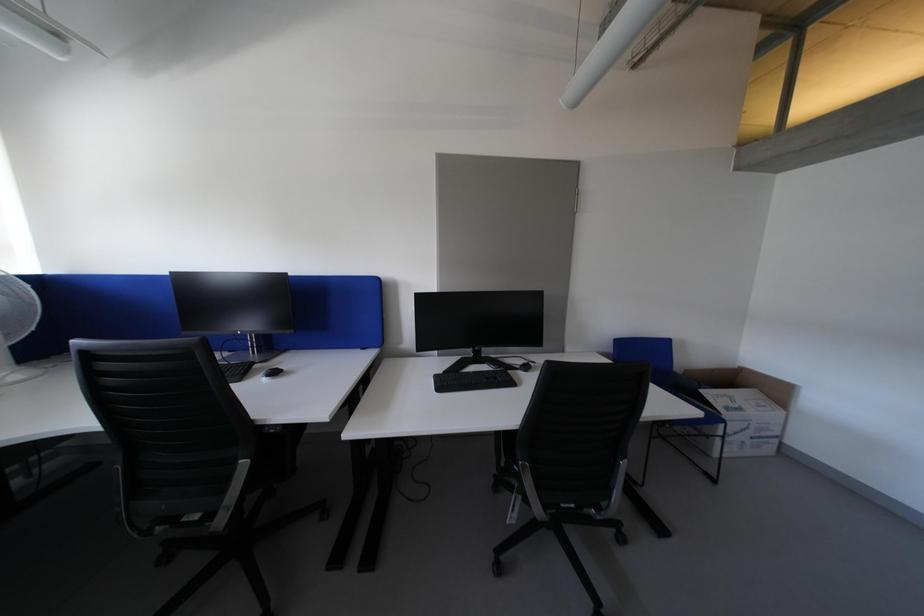
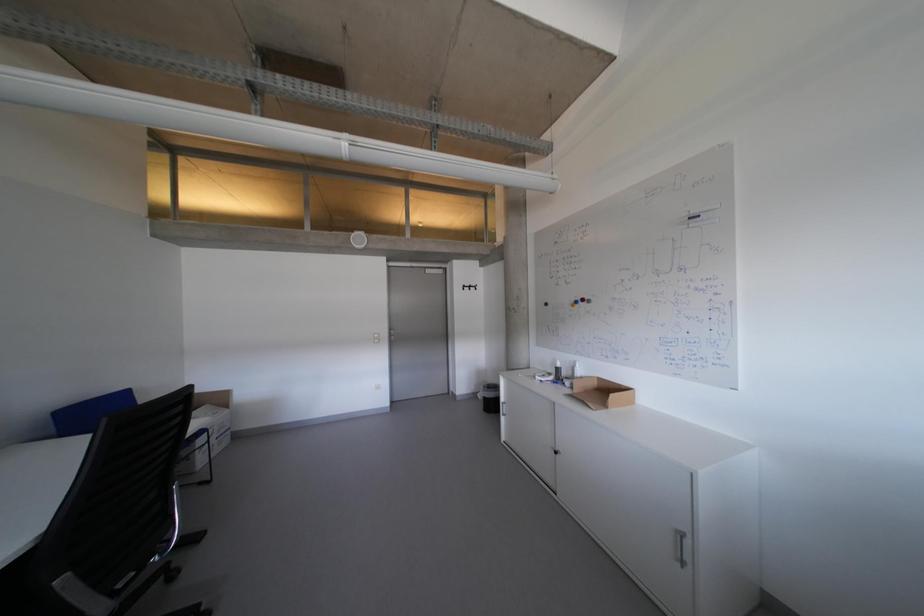
Question: The first image is from the beginning of the video and the second image is from the end. How did the camera likely rotate when shooting the video?

Choices:
 (A) Left
 (B) Right
 (C) Up
 (D) Down

Answer: (B)